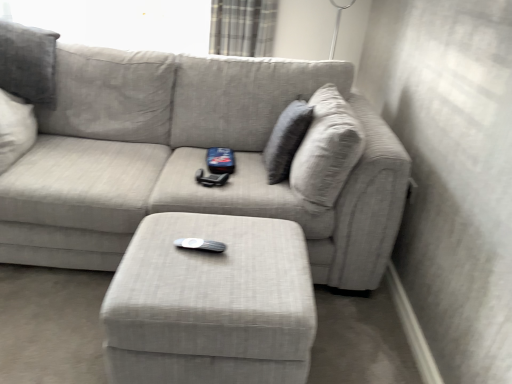
Where is `free space above matte gray ottoman at center (from a real-world perspective)`? free space above matte gray ottoman at center (from a real-world perspective) is located at coordinates point(215,251).